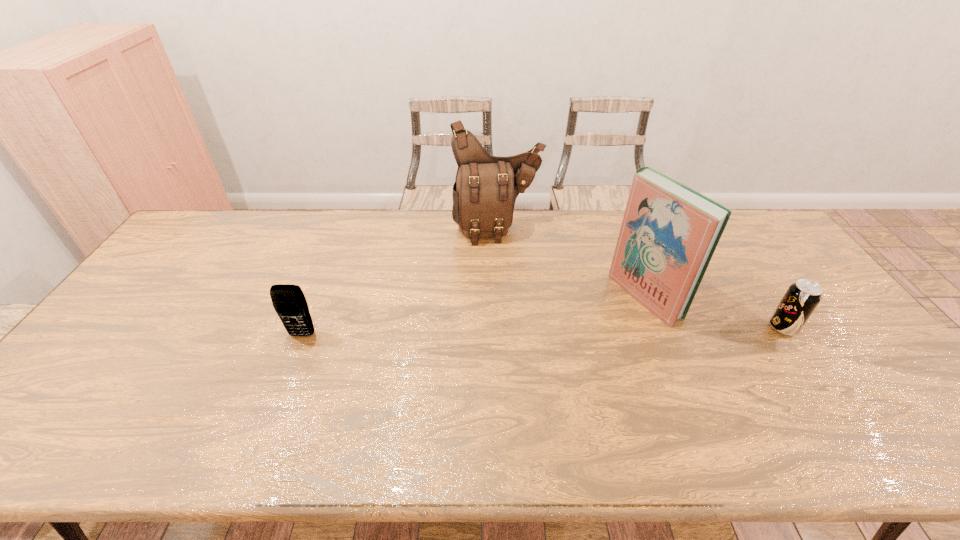
Identify the location of vacant spot on the desktop that is between the leftmost object and the shortest object and is positioned on the front-facing side of the shoulder bag. (530, 332).

This screenshot has width=960, height=540. What are the coordinates of `vacant spot on the desktop that is between the cellular telephone and the soda can and is positioned on the cover of the hardback book` in the screenshot? It's located at (579, 330).